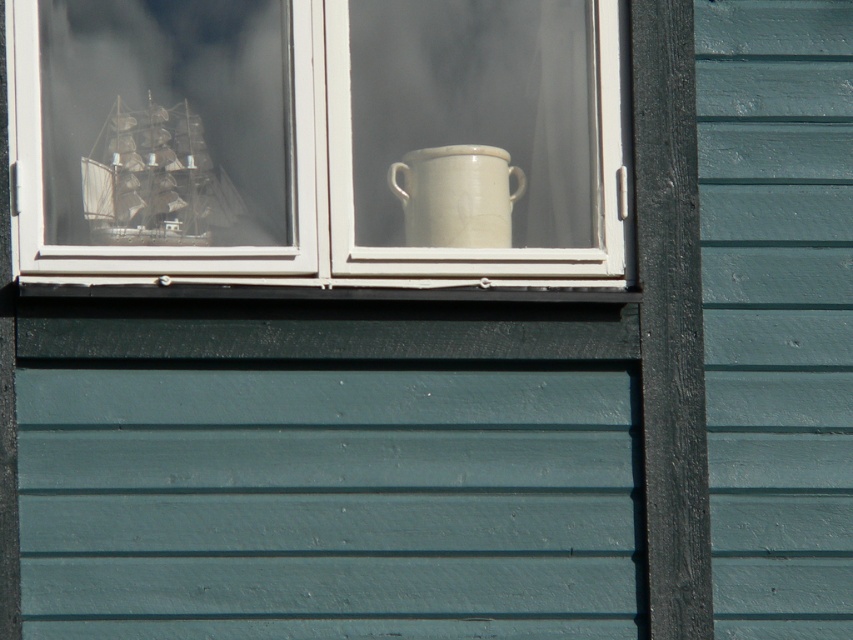
You are standing outside the building looking at the window. There is a wooden ship at left inside the window. If you want to see the ship clearly, should you look to the left or right side of the window?

To see the wooden ship at left clearly, you should look to the left side of the window since the wooden ship at left is positioned at point (155, 180), which is on the left side of the window.

You are standing at a point 5 meters away from the camera. Can you reach the point at coordinates point (119, 157)?

The point point (119, 157) is 5.12 meters away from the camera. Since you are standing 5 meters away from the camera, you would need to move an additional 0.12 meters forward to reach the point point (119, 157).

You are standing outside the building and notice the teal painted wood siding at right and the white ceramic mug at upper center. Which object is higher up on the wall?

The teal painted wood siding at right is taller than the white ceramic mug at upper center, so the teal painted wood siding at right is higher up on the wall.